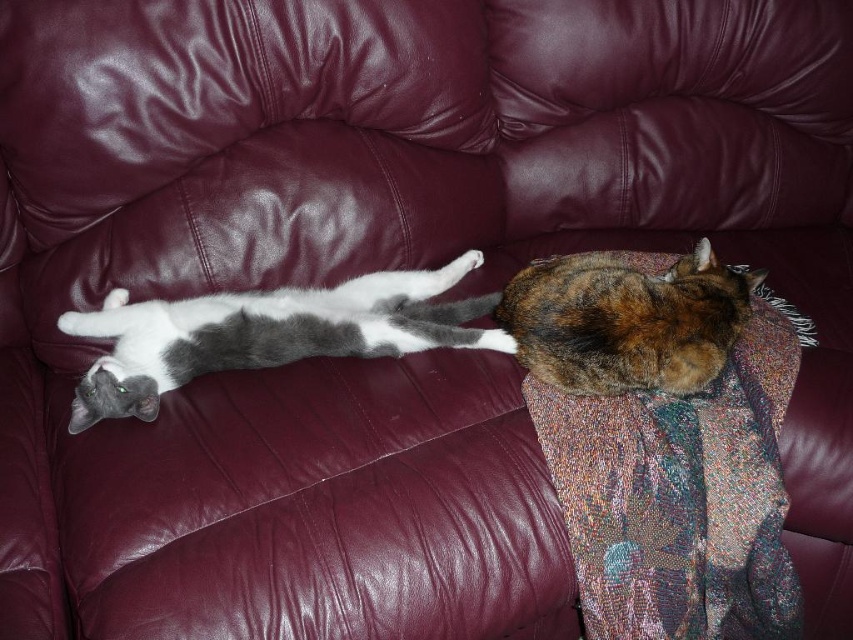
You are a photographer standing in front of the couch with two cats. You want to take a photo focusing on the two points marked on the cats. Which point, point (264, 321) or point (556, 355), is closer to you?

Point (264, 321) is closer to you than point (556, 355).